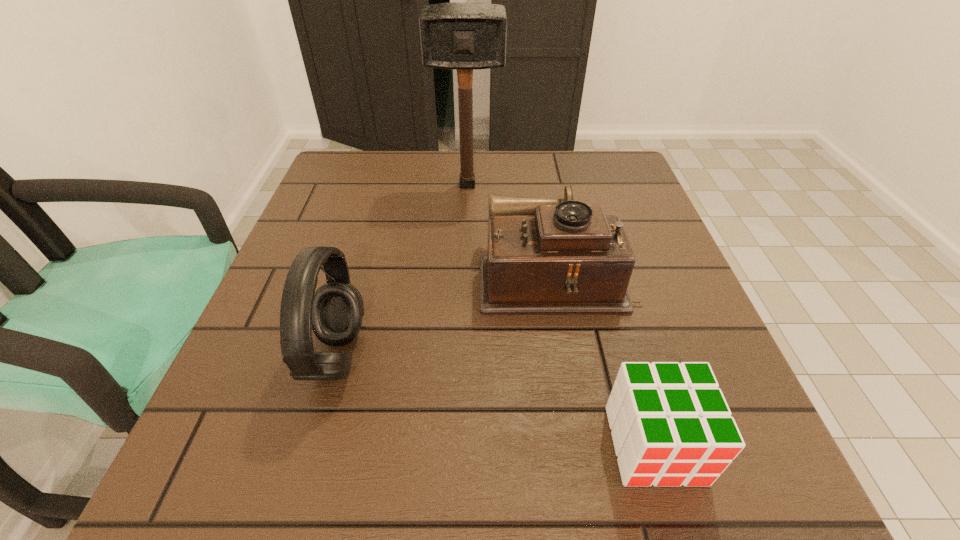
At what (x,y) coordinates should I click in order to perform the action: click on free space at the right edge of the desktop. Please return your answer as a coordinate pair (x, y). Image resolution: width=960 pixels, height=540 pixels. Looking at the image, I should click on (684, 279).

Locate an element on the screen. This screenshot has height=540, width=960. vacant space at the far left corner is located at coordinates click(x=373, y=153).

Identify the location of free location at the near left corner. (211, 482).

The image size is (960, 540). Identify the location of vacant space at the far right corner of the desktop. (642, 197).

Where is `vacant region between the leftmost object and the shortest object`? The height and width of the screenshot is (540, 960). vacant region between the leftmost object and the shortest object is located at coordinates (495, 400).

I want to click on vacant region between the third shortest object and the third tallest object, so click(x=446, y=315).

The image size is (960, 540). In order to click on blank region between the headset and the second shortest object in this screenshot , I will do `click(446, 315)`.

Where is `vacant region between the tallest object and the cube`? vacant region between the tallest object and the cube is located at coordinates (561, 315).

You are a GUI agent. You are given a task and a screenshot of the screen. Output one action in this format:
    pyautogui.click(x=<x>, y=<y>)
    Task: Click on the empty space that is in between the cube and the second tallest object
    
    Given the screenshot: What is the action you would take?
    495,400

Where is `empty space between the phonograph_record and the headset`? This screenshot has width=960, height=540. empty space between the phonograph_record and the headset is located at coordinates (446, 315).